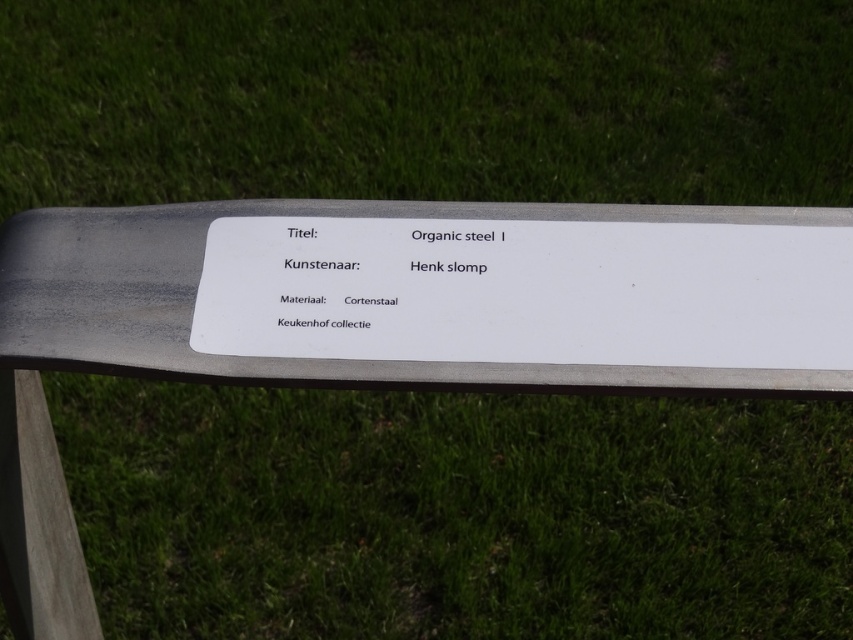
Based on the photo, is cortensteel sign at center taller than white organic steel i at center?

Correct, cortensteel sign at center is much taller as white organic steel i at center.

Is point (817, 218) positioned behind point (328, 236)?

Yes.

Is point (32, 310) behind point (505, 320)?

Yes, it is behind point (505, 320).

Identify the location of cortensteel sign at center. (292, 358).